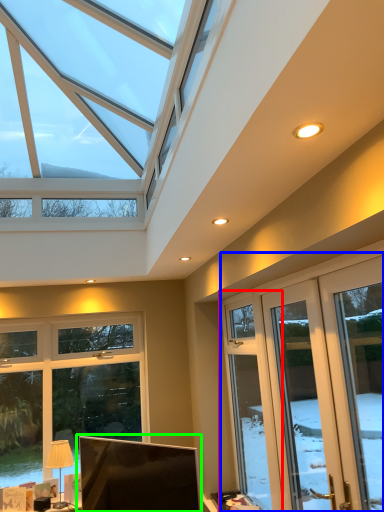
Question: Which object is the closest to the window (highlighted by a red box)? Choose among these: screen door (highlighted by a blue box) or computer monitor (highlighted by a green box).

Choices:
 (A) screen door
 (B) computer monitor

Answer: (A)